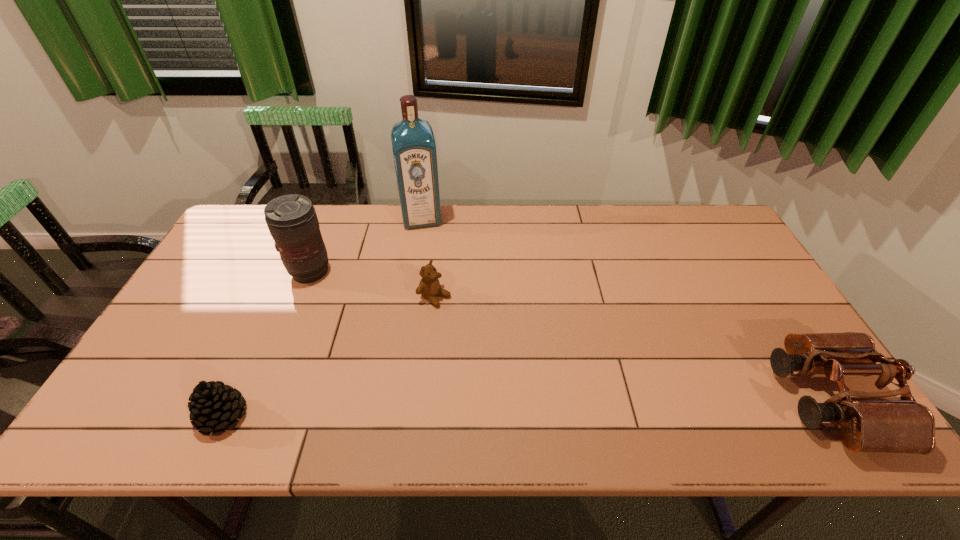
This screenshot has height=540, width=960. In order to click on free point located 0.290m on the front-facing side of the teddy bear in this screenshot , I will do `click(533, 357)`.

Identify the location of vacant region located on the front-facing side of the teddy bear. (471, 319).

Find the location of a particular element. free spot located 0.230m on the front-facing side of the teddy bear is located at coordinates (x=514, y=345).

Locate an element on the screen. This screenshot has width=960, height=540. free spot located on the flat label side of the tallest object is located at coordinates (430, 266).

This screenshot has width=960, height=540. What are the coordinates of `vacant region located 0.090m on the flat label side of the tallest object` in the screenshot? It's located at (426, 247).

You are a GUI agent. You are given a task and a screenshot of the screen. Output one action in this format:
    pyautogui.click(x=<x>, y=<y>)
    Task: Click on the vacant space located on the flat label side of the tallest object
    This screenshot has height=540, width=960.
    Given the screenshot: What is the action you would take?
    pyautogui.click(x=430, y=268)

This screenshot has width=960, height=540. What are the coordinates of `free space located 0.310m on the side of the telephoto lens where the control switches are located` in the screenshot? It's located at (401, 328).

Identify the location of vacant area situated on the side of the telephoto lens where the control switches are located. The height and width of the screenshot is (540, 960). (391, 321).

At what (x,y) coordinates should I click in order to perform the action: click on free location located on the side of the telephoto lens where the control switches are located. Please return your answer as a coordinate pair (x, y). The width and height of the screenshot is (960, 540). Looking at the image, I should click on (341, 291).

Where is `object located at the far edge`? Image resolution: width=960 pixels, height=540 pixels. object located at the far edge is located at coordinates (414, 149).